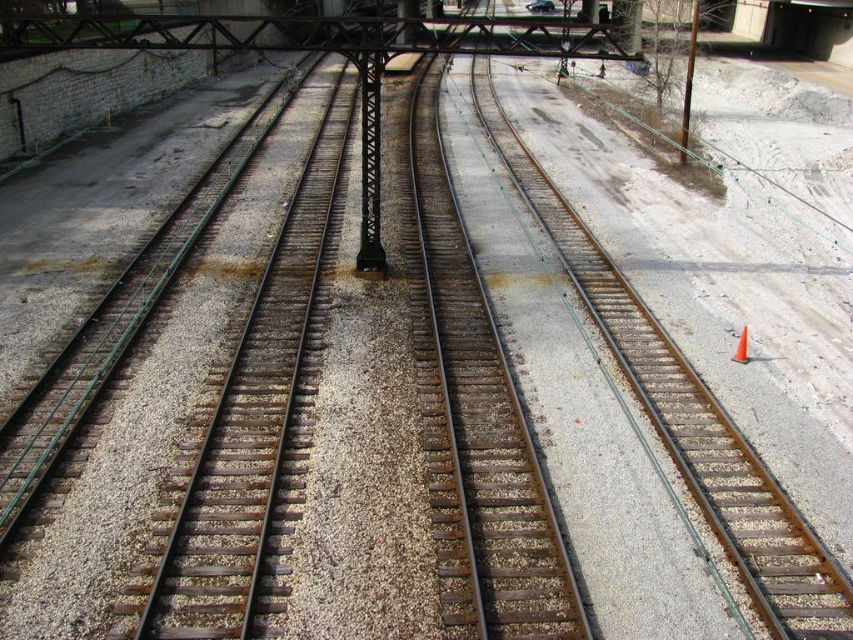
You are a railway inspector standing at the point marked as point (316, 35). You need to inspect the rusty metal bridge at upper center. Which direction should you move to reach it?

The rusty metal bridge at upper center is located at point (316, 35), so you are already at the location of the rusty metal bridge at upper center.

You are standing at the camera position looking at the railway scene. You want to know if you can safely walk to the rusty metal bridge at upper center without crossing the active tracks. The distance between you and the bridge is 41.39 feet. If the safe distance required to avoid the tracks is 30 feet, can you safely reach the bridge?

The distance between you and the rusty metal bridge at upper center is 41.39 feet, which exceeds the required safe distance of 30 feet. Therefore, you can safely reach the bridge without crossing the active tracks.